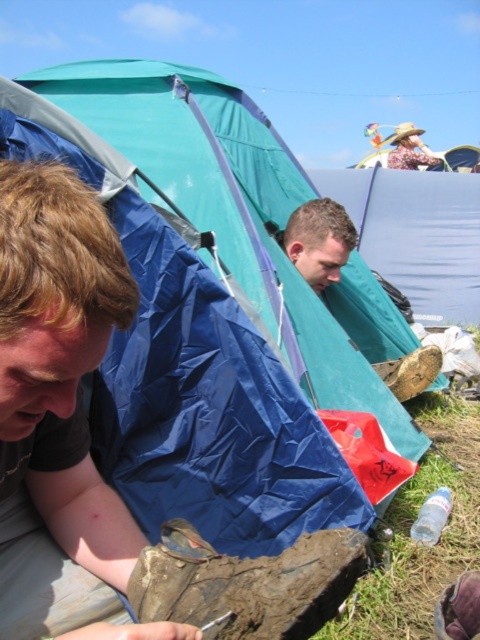
From the picture: Does brown matte shoe at lower left have a greater width compared to blue tarpaulin tent at left?

Incorrect, brown matte shoe at lower left's width does not surpass blue tarpaulin tent at left's.

From the picture: Does brown matte shoe at lower left appear under blue tarpaulin tent at left?

Correct, brown matte shoe at lower left is located below blue tarpaulin tent at left.

What are the coordinates of `brown matte shoe at lower left` in the screenshot? It's located at (56, 396).